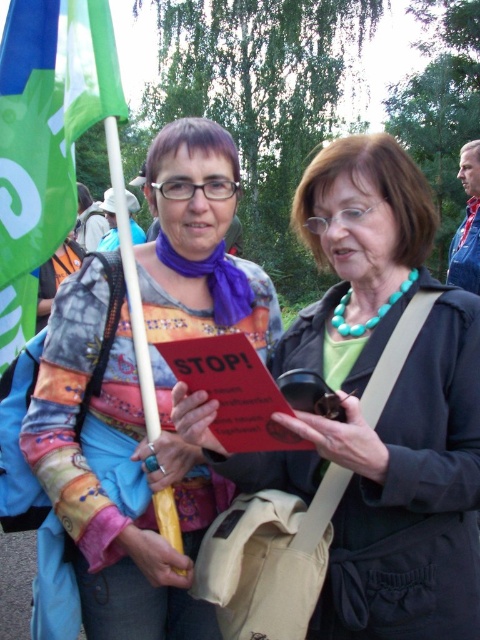
What do you see at coordinates (383, 410) in the screenshot? I see `matte black jacket at center` at bounding box center [383, 410].

Is matte black jacket at center taller than green fabric flag at left?

Indeed, matte black jacket at center has a greater height compared to green fabric flag at left.

Locate an element on the screen. The height and width of the screenshot is (640, 480). matte black jacket at center is located at coordinates (383, 410).

Find the location of a particular element. The height and width of the screenshot is (640, 480). matte black jacket at center is located at coordinates (383, 410).

Describe the element at coordinates (139, 392) in the screenshot. I see `multicolored patchwork shirt at center` at that location.

Can you confirm if multicolored patchwork shirt at center is bigger than green fabric flag at left?

Yes.

Image resolution: width=480 pixels, height=640 pixels. In order to click on multicolored patchwork shirt at center in this screenshot , I will do `click(139, 392)`.

This screenshot has height=640, width=480. In order to click on multicolored patchwork shirt at center in this screenshot , I will do pyautogui.click(x=139, y=392).

Which is behind, point (343, 602) or point (201, 324)?

The point (201, 324) is behind.

From the picture: Which is more to the right, matte black jacket at center or multicolored patchwork shirt at center?

matte black jacket at center is more to the right.

Describe the element at coordinates (383, 410) in the screenshot. The width and height of the screenshot is (480, 640). I see `matte black jacket at center` at that location.

Where is `matte black jacket at center`? Image resolution: width=480 pixels, height=640 pixels. matte black jacket at center is located at coordinates (383, 410).